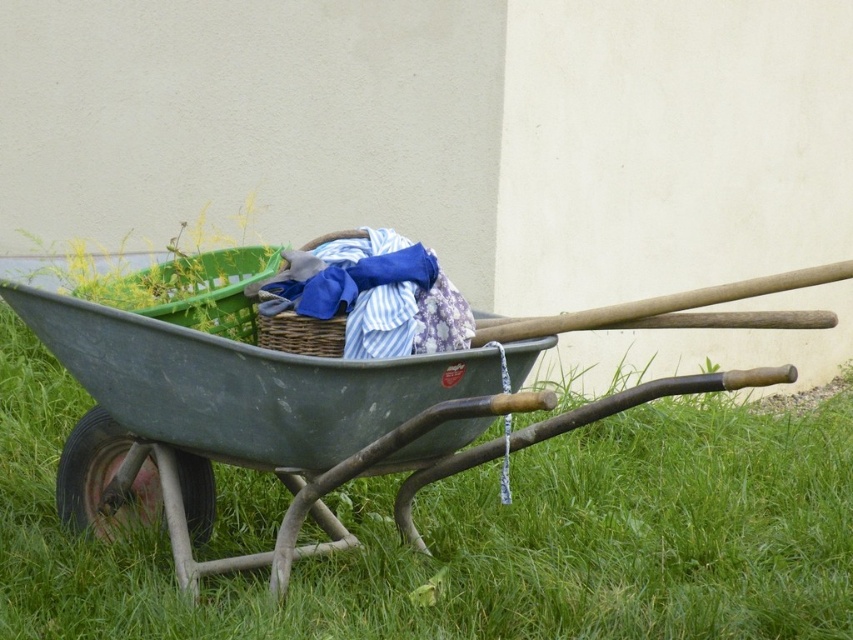
You are organizing items in the wheelbarrow and need to know which item is taller between the blue striped fabric at center and the woven brown basket at center. Which one is taller?

The blue striped fabric at center is taller than the woven brown basket at center according to the description.

You are trying to lift the woven brown basket at center to retrieve an item inside the green metal wheelbarrow at center. Is the basket blocking access to the items inside the wheelbarrow?

The green metal wheelbarrow at center is positioned under the woven brown basket at center, meaning the basket is above the wheelbarrow. To access the items inside the wheelbarrow, you would need to move the basket out of the way first.

You are a delivery person who needs to place a large package that is 20 inches long into the green metal wheelbarrow at center. Can the package fit inside the wheelbarrow if there is already a woven brown basket at center occupying space?

The distance between the green metal wheelbarrow at center and the woven brown basket at center is 18.91 inches. Since the package is 20 inches long, it would not fit as the available space is shorter than the package length.